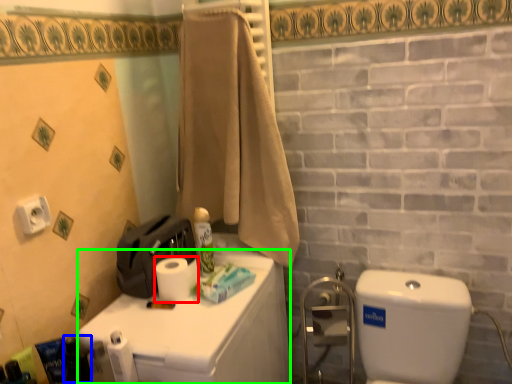
Question: Which object is the closest to the toilet paper (highlighted by a red box)? Choose among these: toiletry (highlighted by a blue box) or counter top (highlighted by a green box).

Choices:
 (A) toiletry
 (B) counter top

Answer: (B)